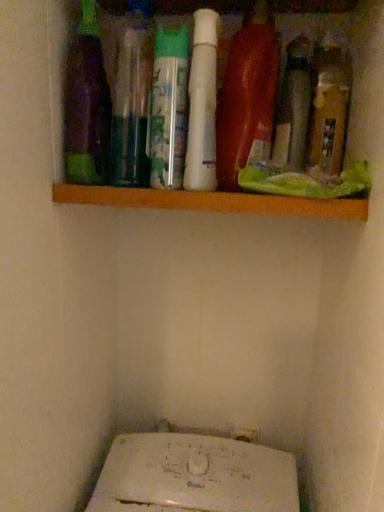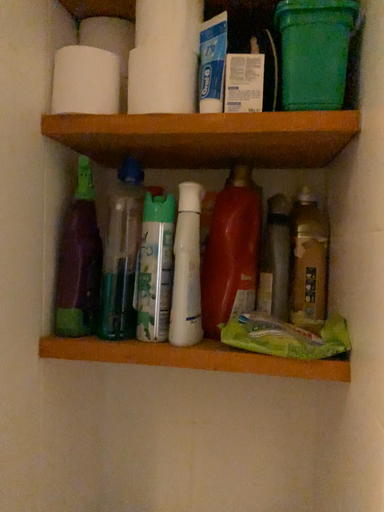
Question: How did the camera likely rotate when shooting the video?

Choices:
 (A) rotated upward
 (B) rotated downward

Answer: (A)